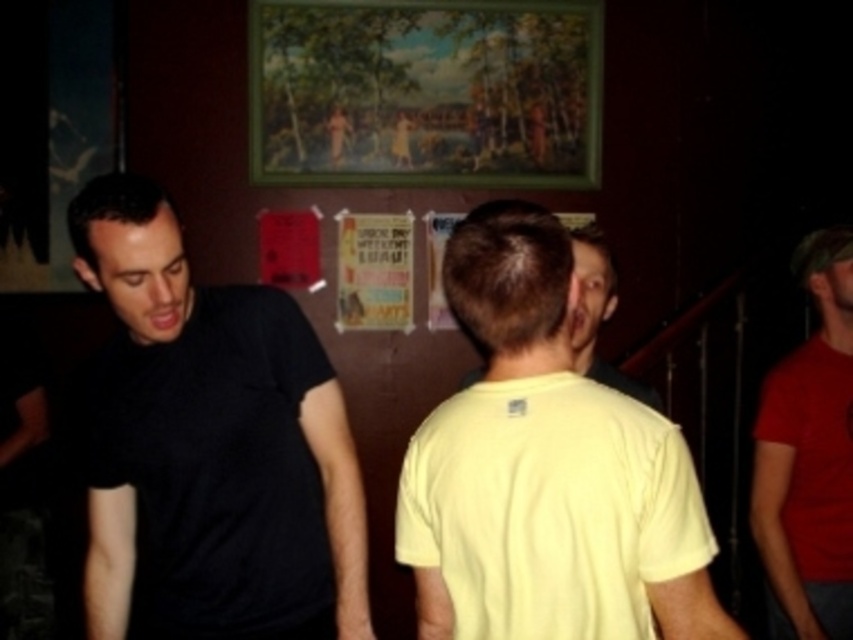
Looking at this image, you are standing in the dimly lit room and want to move closer to both points. Which point, point (x=572, y=536) or point (x=630, y=396), is closer to you?

Point (x=572, y=536) is closer to the viewer than point (x=630, y=396), so you should move towards point (x=572, y=536) first.